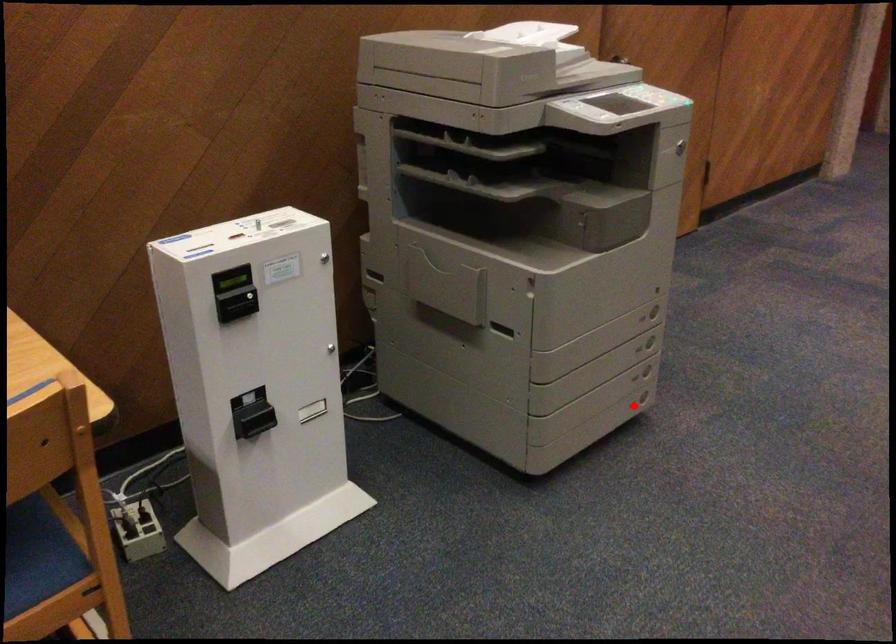
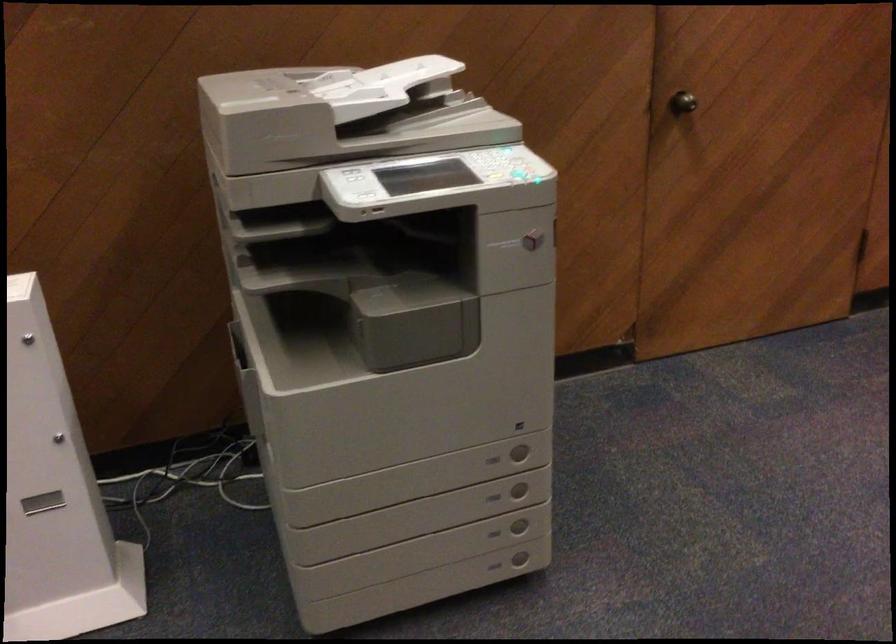
The point at the highlighted location is marked in the first image. Where is the corresponding point in the second image?

(494, 567)